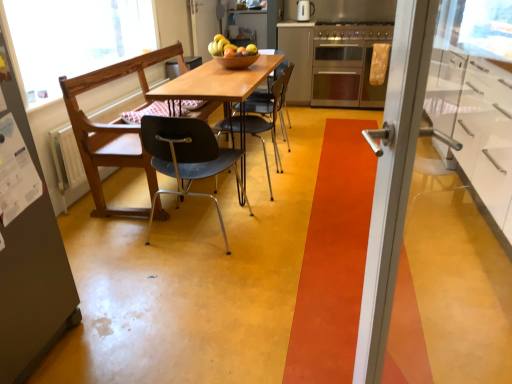
This screenshot has height=384, width=512. In order to click on free space in front of matte black chair at center, the first chair positioned from the front in this screenshot , I will do `click(196, 276)`.